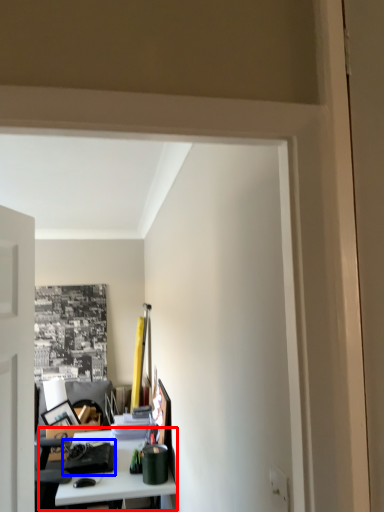
Question: Which point is closer to the camera, table (highlighted by a red box) or stationery (highlighted by a blue box)?

Choices:
 (A) table
 (B) stationery

Answer: (A)